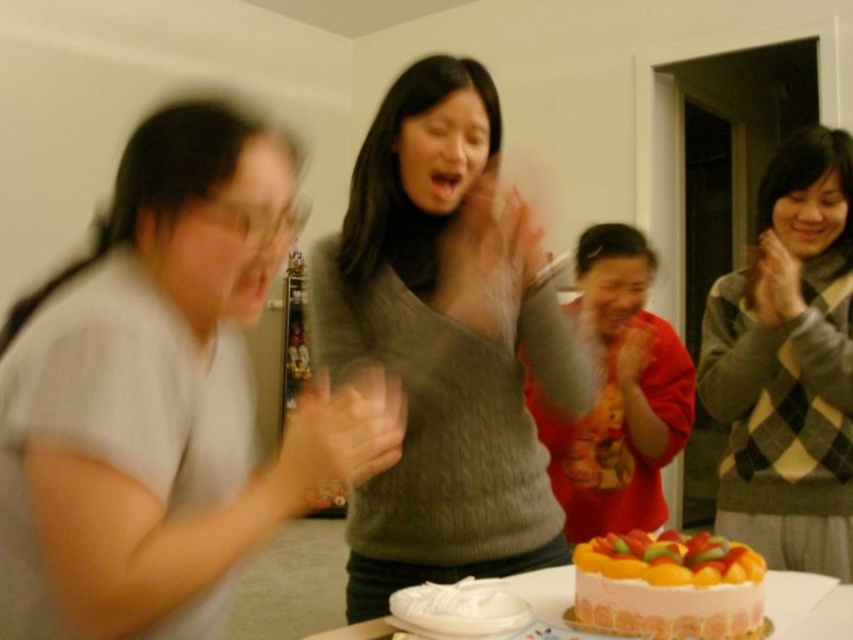
How distant is knitted gray sweater at center from argyle sweater at right?

knitted gray sweater at center is 63.54 centimeters from argyle sweater at right.

Does knitted gray sweater at center have a lesser height compared to argyle sweater at right?

Yes, knitted gray sweater at center is shorter than argyle sweater at right.

What are the coordinates of `knitted gray sweater at center` in the screenshot? It's located at (x=445, y=342).

At what (x,y) coordinates should I click in order to perform the action: click on knitted gray sweater at center. Please return your answer as a coordinate pair (x, y). This screenshot has width=853, height=640. Looking at the image, I should click on (445, 342).

Is soft pink frosting cake at lower center closer to camera compared to smooth gray sweater at center?

Yes, soft pink frosting cake at lower center is in front of smooth gray sweater at center.

Which is behind, point (747, 548) or point (776, 300)?

The point (776, 300) is behind.

Which is behind, point (630, 598) or point (764, 276)?

The point (764, 276) is more distant.

Find the location of a particular element. This screenshot has width=853, height=640. soft pink frosting cake at lower center is located at coordinates coord(668,586).

Between argyle sweater at right and smooth orange cake at lower center, which one is positioned lower?

Positioned lower is smooth orange cake at lower center.

Between argyle sweater at right and smooth orange cake at lower center, which one has more height?

With more height is argyle sweater at right.

Locate an element on the screen. The height and width of the screenshot is (640, 853). argyle sweater at right is located at coordinates (788, 364).